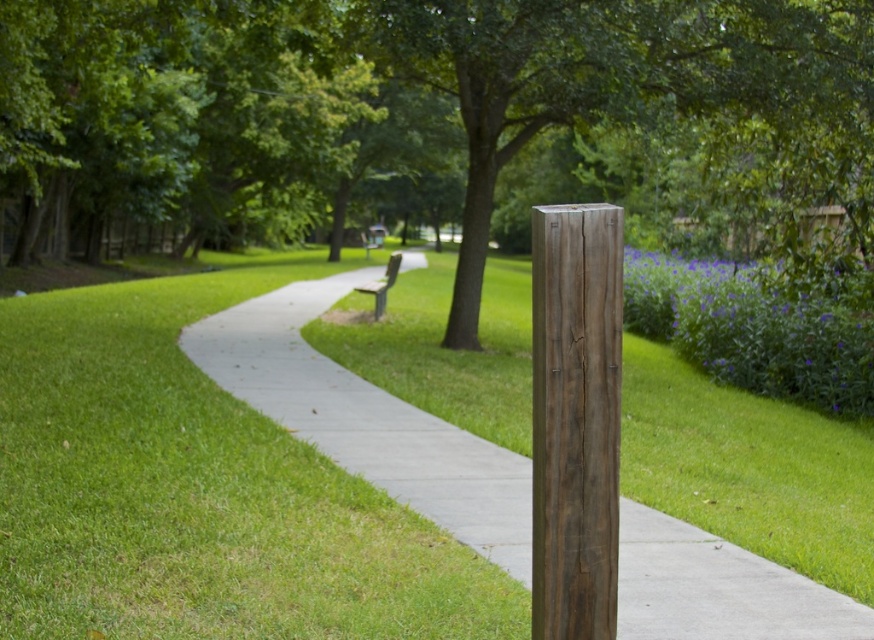
Between gray concrete pavement at center and wooden bench at center, which one is positioned lower?

gray concrete pavement at center is lower down.

Does gray concrete pavement at center appear under wooden bench at center?

Yes.

Image resolution: width=874 pixels, height=640 pixels. I want to click on gray concrete pavement at center, so click(366, 419).

Locate an element on the screen. gray concrete pavement at center is located at coordinates (366, 419).

Between gray concrete pavement at center and weathered wood post at center, which one appears on the right side from the viewer's perspective?

weathered wood post at center

Who is more forward, (681,570) or (580,266)?

Point (580,266) is more forward.

Locate an element on the screen. gray concrete pavement at center is located at coordinates (366, 419).

Is weathered wood post at center wider than wooden bench at center?

In fact, weathered wood post at center might be narrower than wooden bench at center.

Can you confirm if weathered wood post at center is positioned to the left of wooden bench at center?

No, weathered wood post at center is not to the left of wooden bench at center.

Where is `weathered wood post at center`? The height and width of the screenshot is (640, 874). weathered wood post at center is located at coordinates (574, 419).